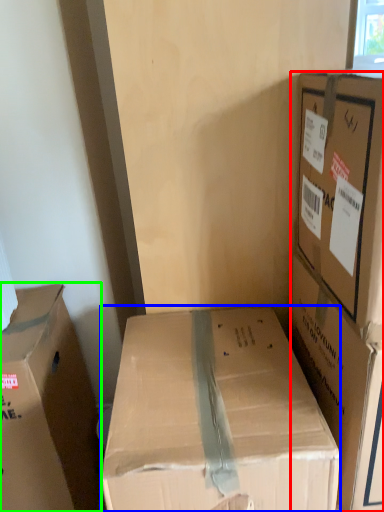
Question: Which object is the farthest from box (highlighted by a red box)? Choose among these: box (highlighted by a blue box) or box (highlighted by a green box).

Choices:
 (A) box
 (B) box

Answer: (B)